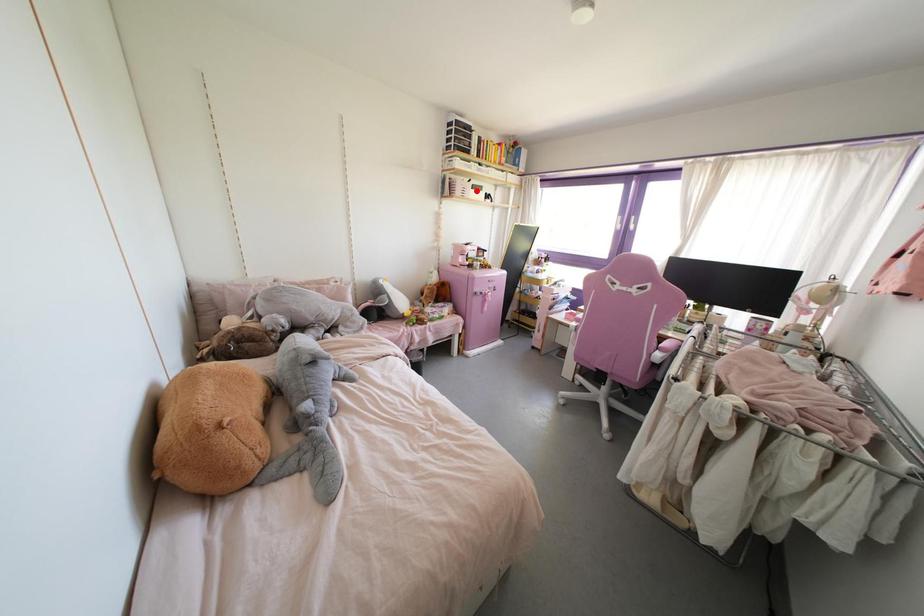
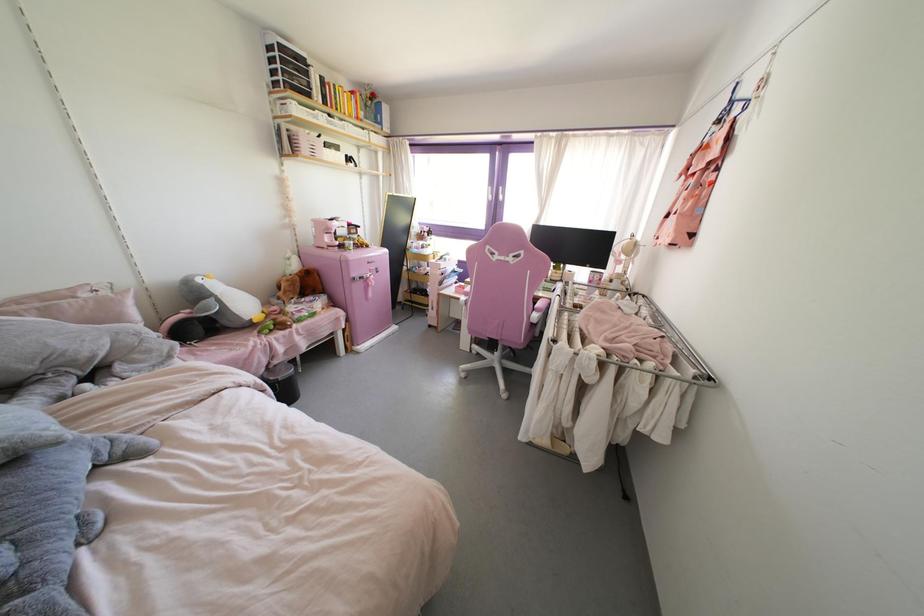
Question: I am providing you with two images of the same scene from different viewpoints. Image1 has a red point marked. In image2, the corresponding 3D location appears at what relative position? Reply with the corresponding letter.

Choices:
 (A) Closer
 (B) Farther

Answer: (B)